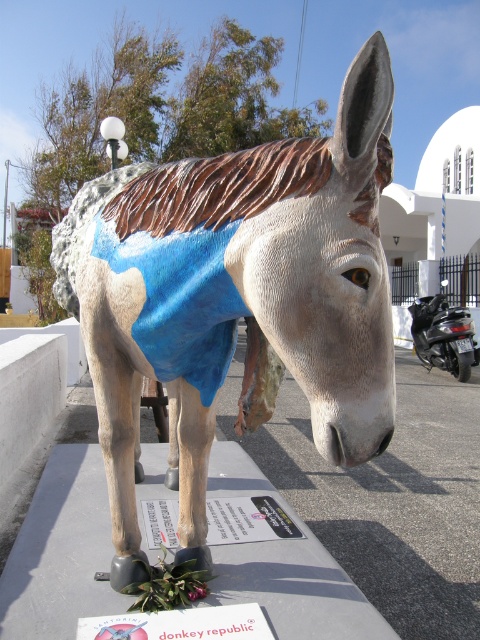
Question: Which point is closer to the camera?

Choices:
 (A) (425, 356)
 (B) (375, 211)

Answer: (B)

Question: Does matte blue fabric donkey at center appear under shiny black scooter at right?

Choices:
 (A) no
 (B) yes

Answer: (A)

Question: Does matte blue fabric donkey at center come in front of shiny black scooter at right?

Choices:
 (A) yes
 (B) no

Answer: (A)

Question: Which object appears farthest from the camera in this image?

Choices:
 (A) shiny black scooter at right
 (B) matte blue fabric donkey at center

Answer: (A)

Question: Is matte blue fabric donkey at center thinner than shiny black scooter at right?

Choices:
 (A) yes
 (B) no

Answer: (B)

Question: Which of the following is the closest to the observer?

Choices:
 (A) matte blue fabric donkey at center
 (B) shiny black scooter at right

Answer: (A)